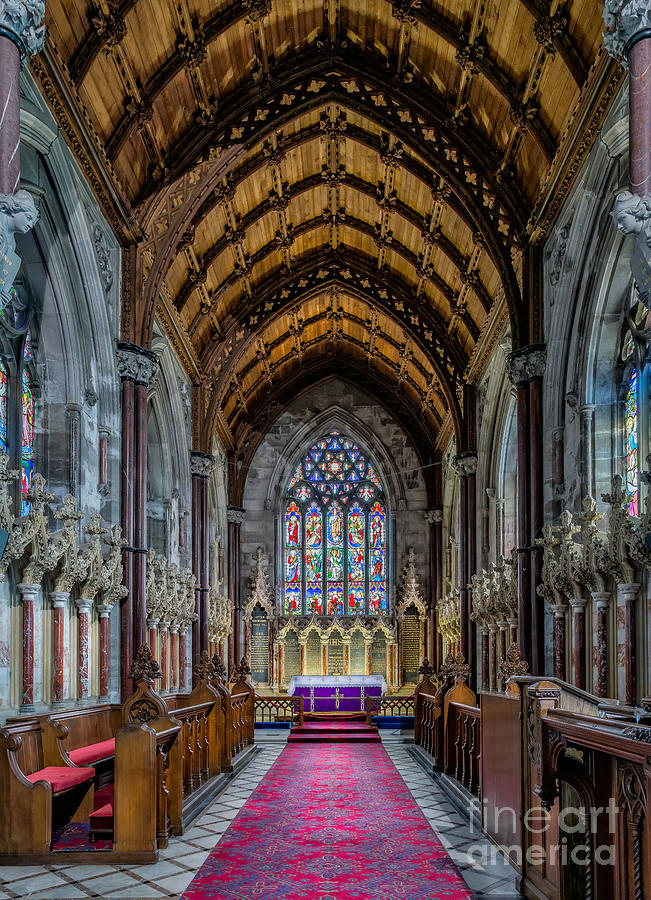
This screenshot has height=900, width=651. Find the location of `backs of pews`. backs of pews is located at coordinates tap(28, 747), tap(74, 729).